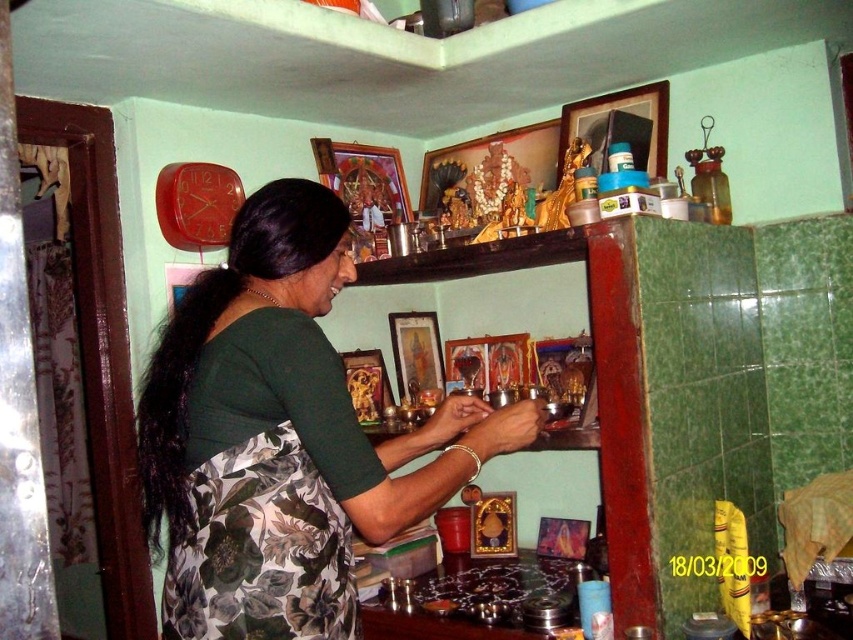
Does green fabric sari at center have a greater height compared to floral fabric apron at lower left?

Yes, green fabric sari at center is taller than floral fabric apron at lower left.

Does point (258, 572) come in front of point (337, 612)?

That is True.

At what (x,y) coordinates should I click in order to perform the action: click on green fabric sari at center. Please return your answer as a coordinate pair (x, y). Looking at the image, I should click on (282, 436).

Identify the location of green fabric sari at center. (282, 436).